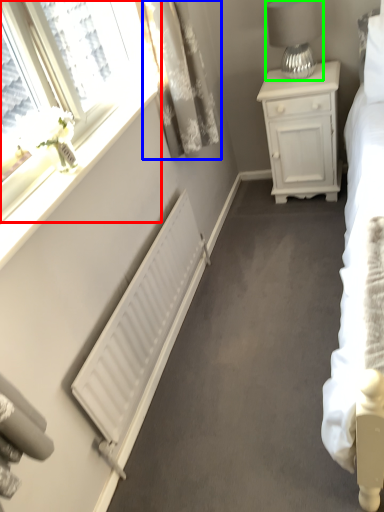
Question: Estimate the real-world distances between objects in this image. Which object is closer to window (highlighted by a red box), curtain (highlighted by a blue box) or table lamp (highlighted by a green box)?

Choices:
 (A) curtain
 (B) table lamp

Answer: (A)